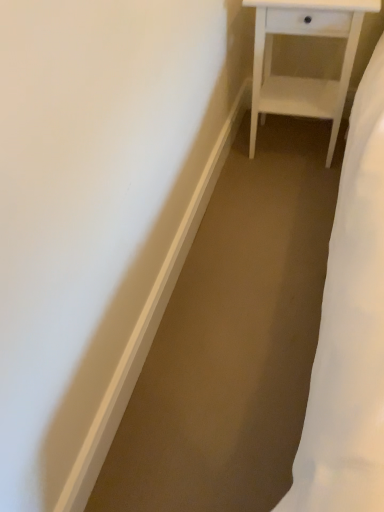
Question: Should I look upward or downward to see white matte nightstand at upper right?

Choices:
 (A) up
 (B) down

Answer: (A)